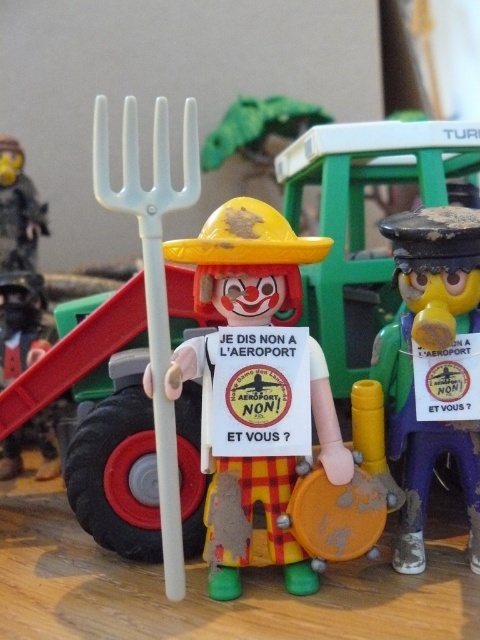
Is matte plastic clown at center taller than brushed metal figure at left?

Yes.

Which is more to the right, matte plastic clown at center or brushed metal figure at left?

From the viewer's perspective, matte plastic clown at center appears more on the right side.

The image size is (480, 640). I want to click on matte plastic clown at center, so click(x=248, y=262).

Image resolution: width=480 pixels, height=640 pixels. Find the location of `matte plastic clown at center`. matte plastic clown at center is located at coordinates (248, 262).

Between matte plastic clown at center and brushed metal fork at upper left, which one appears on the right side from the viewer's perspective?

matte plastic clown at center is more to the right.

Does matte plastic clown at center have a larger size compared to brushed metal fork at upper left?

Correct, matte plastic clown at center is larger in size than brushed metal fork at upper left.

Where is `matte plastic clown at center`? matte plastic clown at center is located at coordinates (248, 262).

Who is positioned more to the left, matte plastic clown at center or matte black sign at right?

matte plastic clown at center is more to the left.

Is matte plastic clown at center further to the viewer compared to matte black sign at right?

No.

Is point (266, 518) more distant than point (456, 448)?

No, (266, 518) is closer to viewer.

The height and width of the screenshot is (640, 480). Identify the location of matte plastic clown at center. (248, 262).